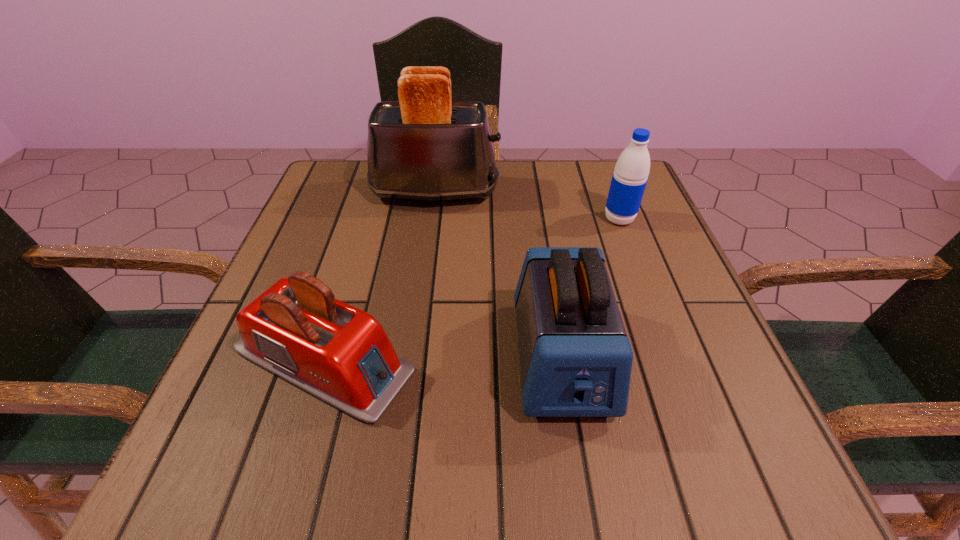
The height and width of the screenshot is (540, 960). In order to click on vacant space that is in between the water bottle and the shortest toaster in this screenshot , I will do point(471,289).

You are a GUI agent. You are given a task and a screenshot of the screen. Output one action in this format:
    pyautogui.click(x=<x>, y=<y>)
    Task: Click on the vacant region between the tallest object and the shortest toaster
    
    Given the screenshot: What is the action you would take?
    pyautogui.click(x=379, y=276)

Image resolution: width=960 pixels, height=540 pixels. I want to click on vacant space that's between the rightmost object and the shortest toaster, so click(x=471, y=289).

Identify the location of vacant space that is in between the tallest object and the rightmost object. The height and width of the screenshot is (540, 960). (527, 206).

Where is `free point between the tallest toaster and the rightmost toaster`? The image size is (960, 540). free point between the tallest toaster and the rightmost toaster is located at coordinates (498, 275).

The height and width of the screenshot is (540, 960). I want to click on free space between the farthest toaster and the water bottle, so click(527, 206).

Locate an element on the screen. Image resolution: width=960 pixels, height=540 pixels. free space between the tallest toaster and the shortest object is located at coordinates (379, 276).

At what (x,y) coordinates should I click in order to perform the action: click on free space between the rightmost toaster and the shortest object. Please return your answer as a coordinate pair (x, y). This screenshot has height=540, width=960. Looking at the image, I should click on (443, 359).

Image resolution: width=960 pixels, height=540 pixels. I want to click on empty space between the third object from left to right and the farthest toaster, so click(x=498, y=275).

You are a GUI agent. You are given a task and a screenshot of the screen. Output one action in this format:
    pyautogui.click(x=<x>, y=<y>)
    Task: Click on the object that is the third closest to the rightmost toaster
    The width and height of the screenshot is (960, 540).
    Given the screenshot: What is the action you would take?
    pyautogui.click(x=426, y=147)